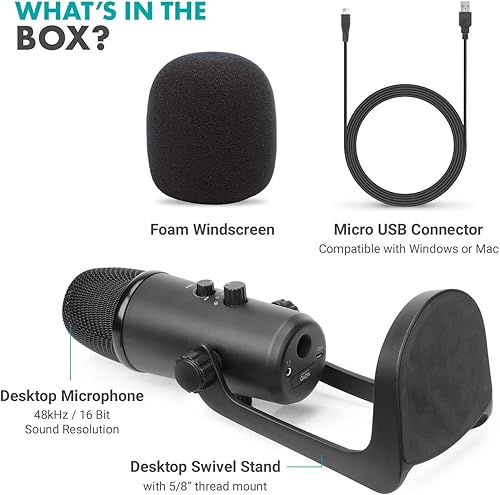
The height and width of the screenshot is (495, 500). Find the location of `stand`. stand is located at coordinates (352, 460).